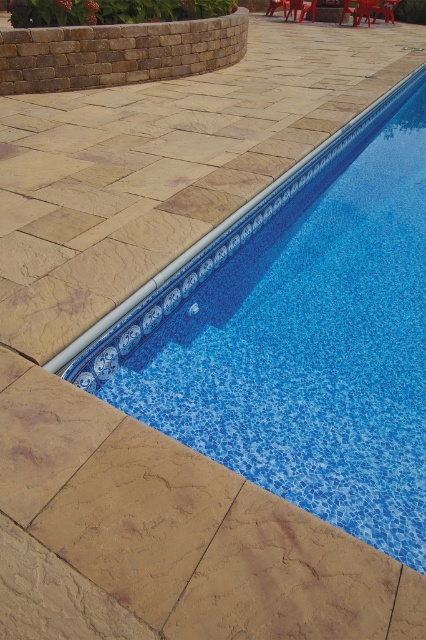
Is point (400, 0) more distant than point (302, 4)?

Yes.

Does matte plastic chair at upper right appear on the right side of red plastic chair at upper right?

Correct, you'll find matte plastic chair at upper right to the right of red plastic chair at upper right.

Does point (391, 19) come behind point (313, 10)?

That is True.

The image size is (426, 640). Identify the location of matte plastic chair at upper right. (385, 8).

Where is `blue glossy pool at center`? The width and height of the screenshot is (426, 640). blue glossy pool at center is located at coordinates (302, 337).

Who is positioned more to the right, blue glossy pool at center or red plastic chair at upper right?

From the viewer's perspective, red plastic chair at upper right appears more on the right side.

The image size is (426, 640). Find the location of `blue glossy pool at center`. blue glossy pool at center is located at coordinates (302, 337).

Is point (402, 109) farther from viewer compared to point (294, 19)?

No, it is in front of (294, 19).

Consider the image. Who is shorter, blue glossy pool at center or brown plastic chair at upper center?

brown plastic chair at upper center

This screenshot has width=426, height=640. What do you see at coordinates (302, 337) in the screenshot?
I see `blue glossy pool at center` at bounding box center [302, 337].

Where is `blue glossy pool at center`? The height and width of the screenshot is (640, 426). blue glossy pool at center is located at coordinates (302, 337).